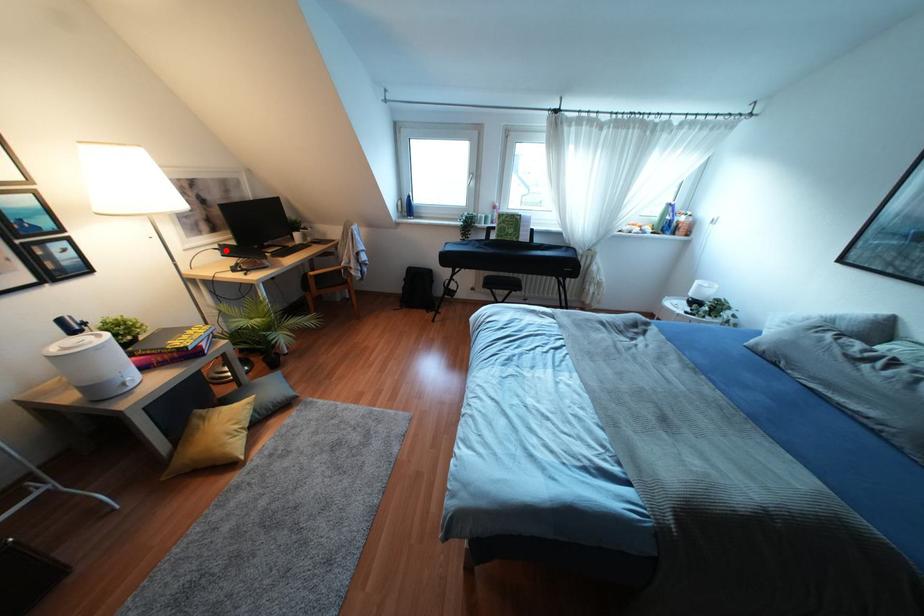
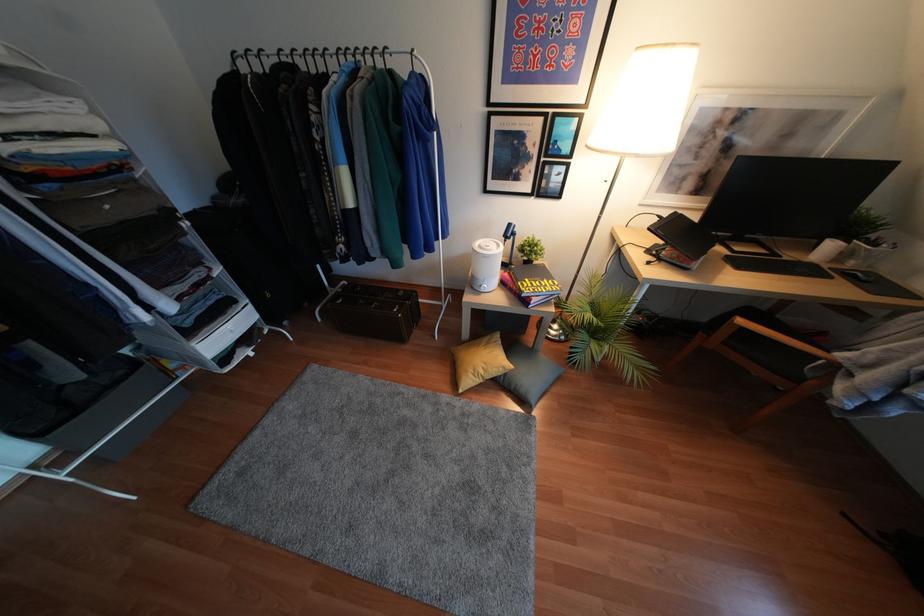
The point at the highlighted location is marked in the first image. Where is the corresponding point in the second image?

(666, 224)